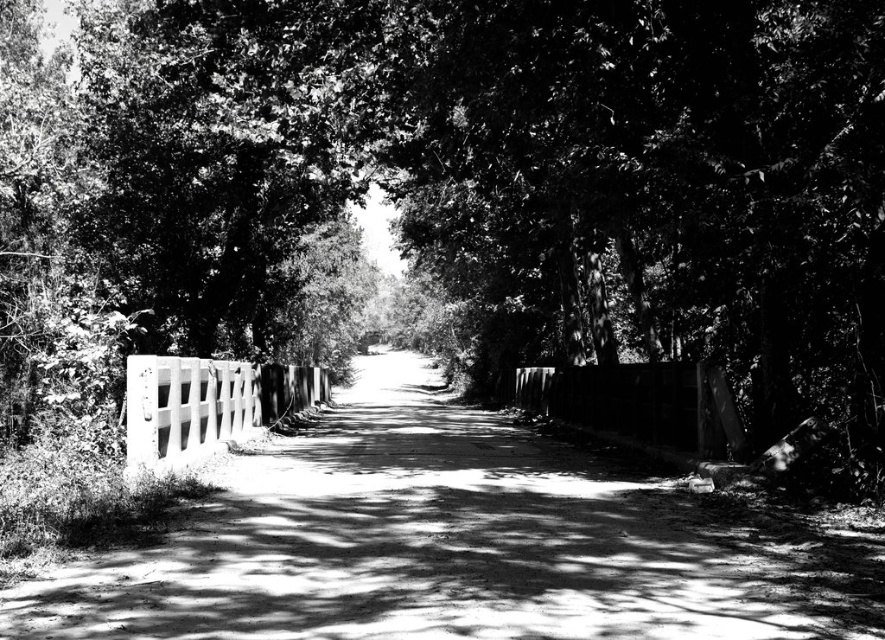
You are standing at the center of the dirt road in the image. Looking towards the left side of the road, can you see the smooth concrete fence at left at point (206, 404)?

Yes, the smooth concrete fence at left is located at point (206, 404) on the left side of the dirt road, so it is visible from the center of the road.

You are a painter standing on the dirt road in the image. You want to paint both the white wooden fence at left and the smooth concrete fence at left. Which fence should you focus on first if you want to paint the larger one?

The white wooden fence at left is larger in size than the smooth concrete fence at left, so you should focus on painting the white wooden fence at left first.